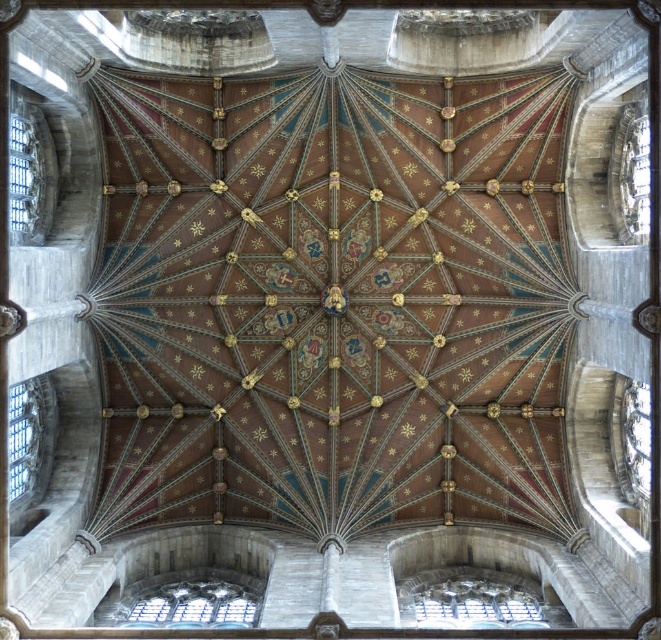
Question: Considering the relative positions of transparent glass window at lower center and clear glass window at lower left in the image provided, where is transparent glass window at lower center located with respect to clear glass window at lower left?

Choices:
 (A) right
 (B) left

Answer: (A)

Question: Is clear glass window at lower left below transparent glass window at left?

Choices:
 (A) no
 (B) yes

Answer: (B)

Question: Among these objects, which one is nearest to the camera?

Choices:
 (A) transparent glass window at left
 (B) clear glass window at lower left

Answer: (A)

Question: Which object appears closest to the camera in this image?

Choices:
 (A) transparent glass window at left
 (B) clear glass window at lower left
 (C) transparent glass window at lower center

Answer: (A)

Question: Which object is closer to the camera taking this photo?

Choices:
 (A) transparent glass window at lower center
 (B) clear glass window at lower left

Answer: (B)

Question: Is transparent glass window at lower center closer to the viewer compared to transparent glass window at left?

Choices:
 (A) no
 (B) yes

Answer: (A)